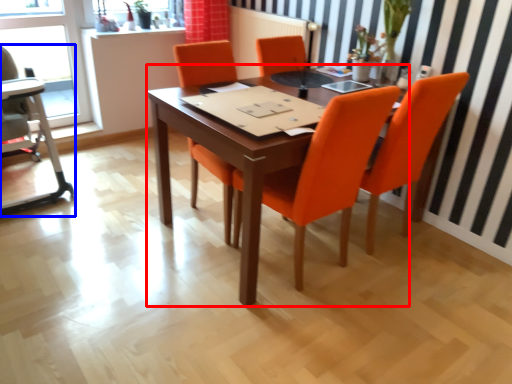
Question: Which object is further to the camera taking this photo, table (highlighted by a red box) or armchair (highlighted by a blue box)?

Choices:
 (A) table
 (B) armchair

Answer: (B)